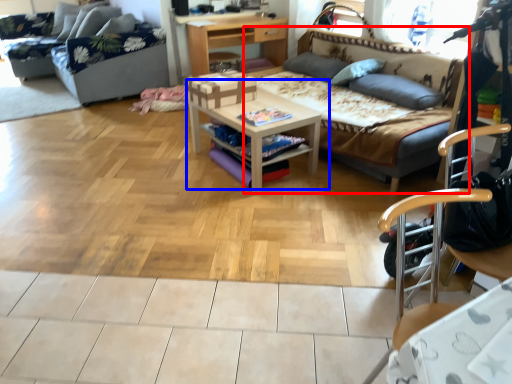
Question: Among these objects, which one is nearest to the camera, studio couch (highlighted by a red box) or table (highlighted by a blue box)?

Choices:
 (A) studio couch
 (B) table

Answer: (A)